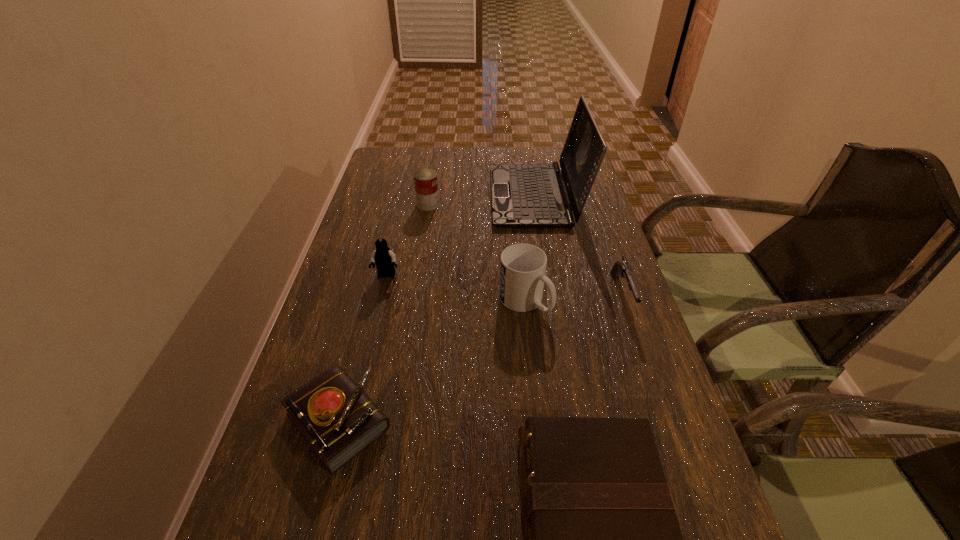
This screenshot has height=540, width=960. Find the location of `vacant area that lies between the rightmost object and the diary`. vacant area that lies between the rightmost object and the diary is located at coordinates (480, 358).

Point out which object is positioned as the nearest to the can. Please provide its 2D coordinates. Your answer should be formatted as a tuple, i.e. [(x, y)], where the tuple contains the x and y coordinates of a point satisfying the conditions above.

[(524, 195)]

At what (x,y) coordinates should I click in order to perform the action: click on object that is the second closest to the laptop computer. Please return your answer as a coordinate pair (x, y). This screenshot has width=960, height=540. Looking at the image, I should click on (622, 267).

Image resolution: width=960 pixels, height=540 pixels. I want to click on free space that satisfies the following two spatial constraints: 1. on the front label of the can; 2. on the front-facing side of the Lego, so click(417, 276).